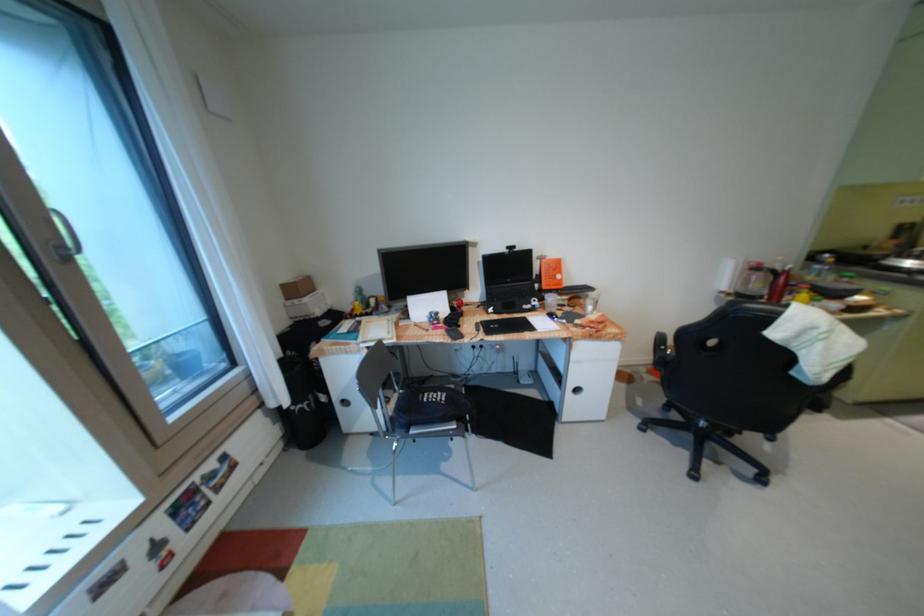
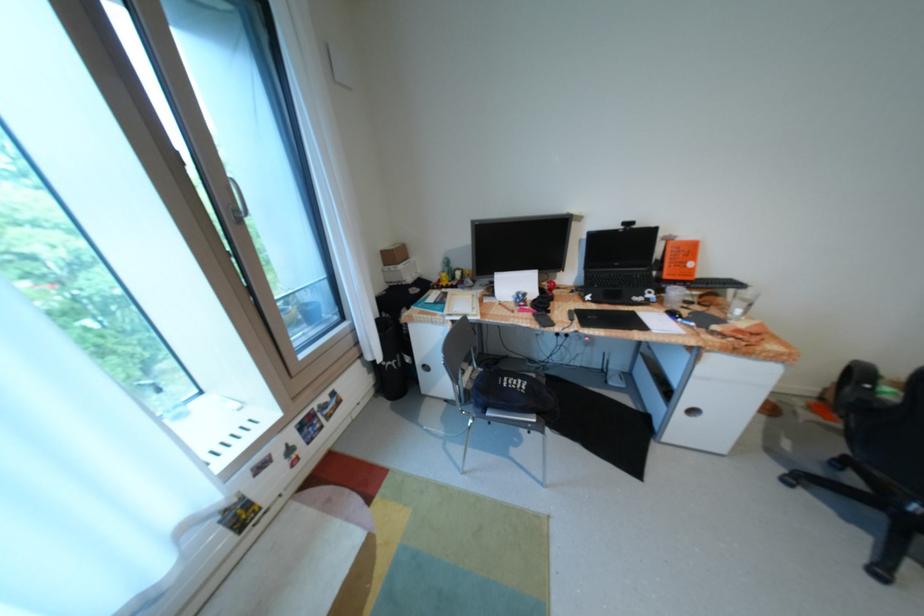
The point at [73,248] is marked in the first image. Where is the corresponding point in the second image?

(247, 211)